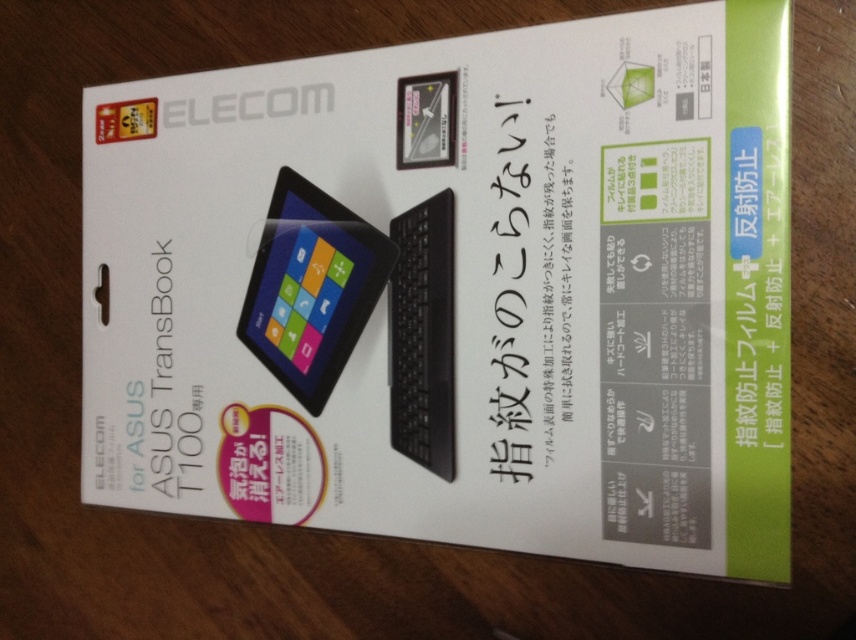
You are designing a storage box for the ASUS TransBook T100 and its accessories. The box must fit both the matte black tablet at center and the black matte keyboard at center. Based on the packaging image, which object should be placed first to ensure both fit properly?

The matte black tablet at center has a larger width than the black matte keyboard at center, so you should place the matte black tablet at center first to ensure proper fitting for both items.

You are holding the packaging for the ASUS TransBook T100 screen protector. On the packaging, there is a point labeled at coordinates point (311, 288). According to the packaging, where is this point located?

The point (311, 288) is located on the matte black tablet at center.

You are holding the packaging and want to see both the matte black tablet at center and the black matte keyboard at center clearly. Which object is closer to you on the packaging?

The matte black tablet at center is closer to you than the black matte keyboard at center because the black matte keyboard at center is positioned behind it.